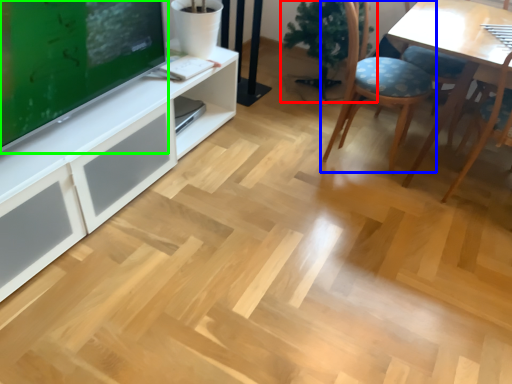
Question: Which object is the closest to the houseplant (highlighted by a red box)? Choose among these: chair (highlighted by a blue box) or television (highlighted by a green box).

Choices:
 (A) chair
 (B) television

Answer: (A)